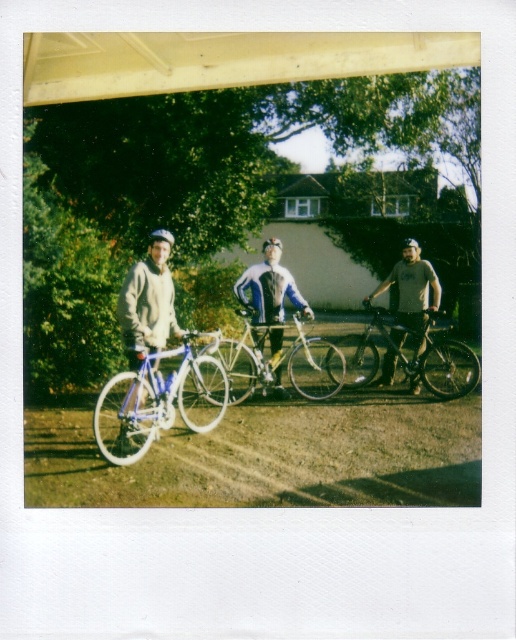
Between point (385, 314) and point (412, 241), which one is positioned in front?

Point (385, 314) is more forward.

Find the location of a particular element. The height and width of the screenshot is (640, 516). shiny black bicycle at center is located at coordinates (x=413, y=355).

Does point (253, 298) come in front of point (405, 282)?

Yes, point (253, 298) is in front of point (405, 282).

Can you confirm if blue fabric jacket at center is bigger than matte gray shirt at center?

No.

Who is more forward, (285, 284) or (430, 280)?

Point (285, 284) is in front.

You are a GUI agent. You are given a task and a screenshot of the screen. Output one action in this format:
    pyautogui.click(x=<x>, y=<y>)
    Task: Click on the blue fabric jacket at center
    This screenshot has height=640, width=516.
    Given the screenshot: What is the action you would take?
    pyautogui.click(x=269, y=304)

Between blue fabric jacket at center and matte black helmet at center, which one is positioned lower?

blue fabric jacket at center is below.

Does blue fabric jacket at center appear on the left side of matte black helmet at center?

Correct, you'll find blue fabric jacket at center to the left of matte black helmet at center.

Measure the distance between point [298,301] and camera.

They are 34.18 feet apart.

Identify the location of blue fabric jacket at center. (269, 304).